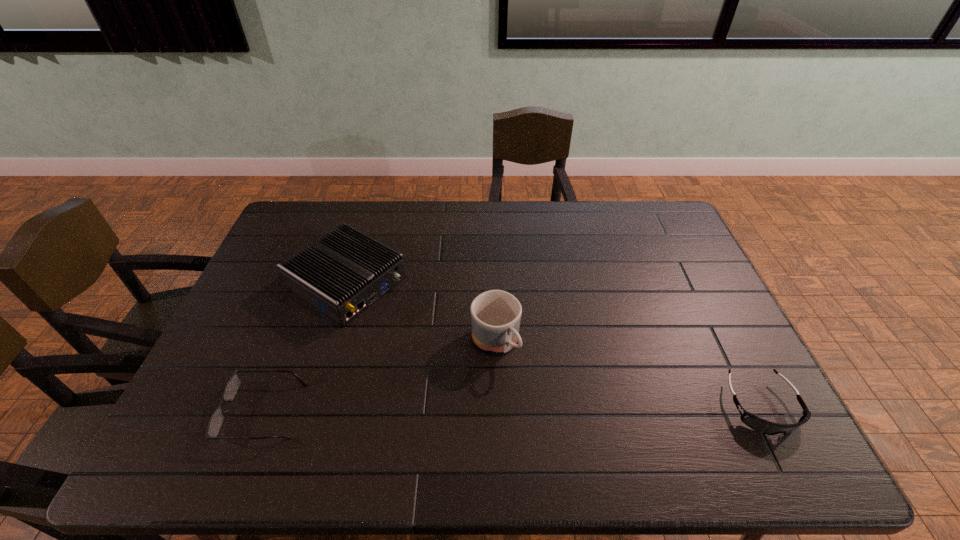
Image resolution: width=960 pixels, height=540 pixels. Identify the location of vacant space on the desktop that is between the shortest object and the third tallest object and is positioned on the back panel of the router. (550, 408).

At what (x,y) coordinates should I click in order to perform the action: click on free space on the desktop that is between the shortest object and the rightmost object and is positioned on the side with the handle of the tallest object. Please return your answer as a coordinate pair (x, y). The width and height of the screenshot is (960, 540). Looking at the image, I should click on (548, 408).